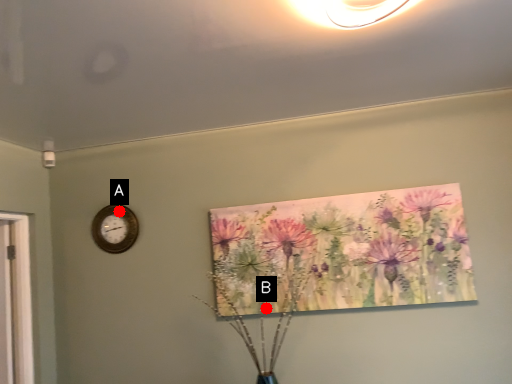
Question: Two points are circled on the image, labeled by A and B beside each circle. Which point is further to the camera?

Choices:
 (A) A is further
 (B) B is further

Answer: (A)